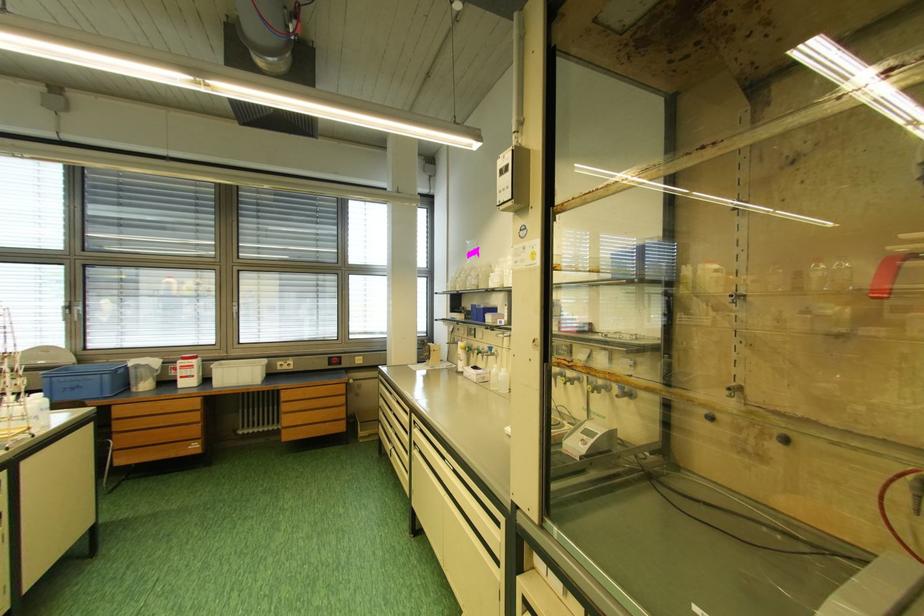
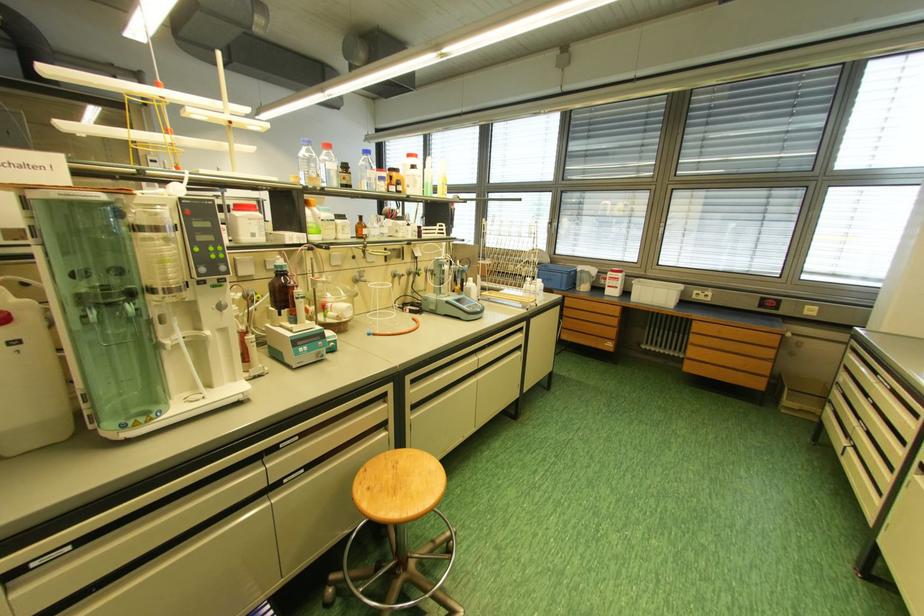
In the second image, find the point that corresponds to (71,371) in the first image.

(551, 269)